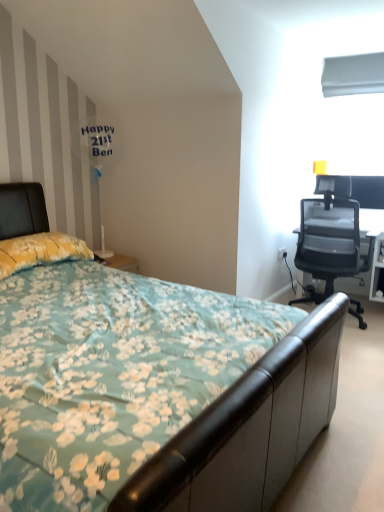
Question: Is yellow floral fabric pillow at left bigger or smaller than white glossy table lamp at upper left?

Choices:
 (A) big
 (B) small

Answer: (B)

Question: In the image, is yellow floral fabric pillow at left on the left side or the right side of white glossy table lamp at upper left?

Choices:
 (A) left
 (B) right

Answer: (A)

Question: Which object is positioned farthest from the transparent mesh office chair at right?

Choices:
 (A) floral fabric bed at center
 (B) white smooth plastic at upper right
 (C) yellow floral fabric pillow at left
 (D) white plastic power outlet at right
 (E) white glossy table lamp at upper left

Answer: (C)

Question: Which of these objects is positioned closest to the yellow floral fabric pillow at left?

Choices:
 (A) white glossy table lamp at upper left
 (B) white plastic power outlet at right
 (C) transparent mesh office chair at right
 (D) white smooth plastic at upper right
 (E) floral fabric bed at center

Answer: (E)